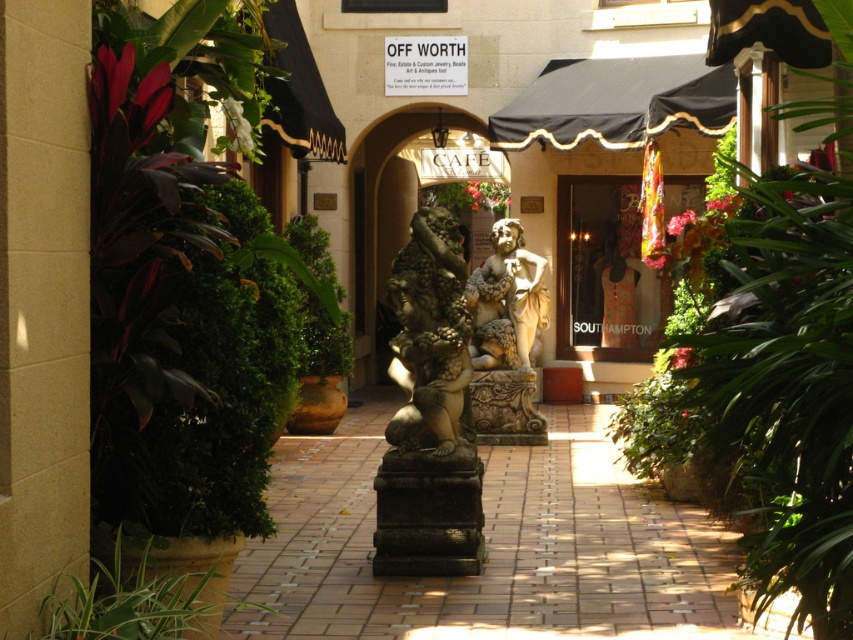
Question: Can you confirm if marble statue at center is smaller than green leafy bush at center?

Choices:
 (A) yes
 (B) no

Answer: (B)

Question: Among these objects, which one is nearest to the camera?

Choices:
 (A) marble statue at center
 (B) green leafy bush at center

Answer: (B)

Question: Is stone statue at center closer to the viewer compared to green leafy bush at center?

Choices:
 (A) yes
 (B) no

Answer: (B)

Question: Can you confirm if green leafy plant at lower left is positioned above marble statue at center?

Choices:
 (A) yes
 (B) no

Answer: (B)

Question: Which of the following is the closest to the observer?

Choices:
 (A) (108, 570)
 (B) (541, 429)
 (C) (312, 355)

Answer: (A)

Question: Which object appears farthest from the camera in this image?

Choices:
 (A) green leafy bush at center
 (B) stone statue at center

Answer: (B)